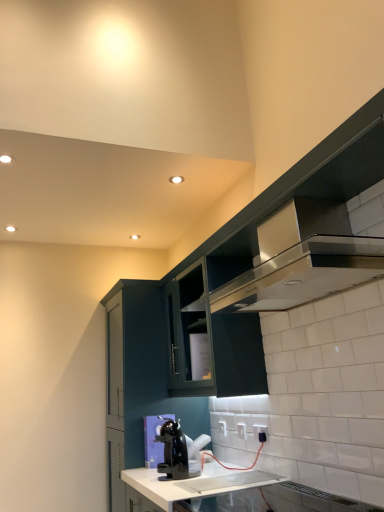
Question: Is matte dark green cabinet at center, positioned as the third cabinetry in right-to-left order, situated inside white glossy countertop at lower center or outside?

Choices:
 (A) inside
 (B) outside

Answer: (B)

Question: Considering the positions of matte dark green cabinet at center, positioned as the third cabinetry in right-to-left order, and white glossy countertop at lower center in the image, is matte dark green cabinet at center, positioned as the third cabinetry in right-to-left order, wider or thinner than white glossy countertop at lower center?

Choices:
 (A) thin
 (B) wide

Answer: (A)

Question: Which is farther from the matte dark green cabinet at center, which is the first cabinetry from left to right?

Choices:
 (A) satin silver exhaust hood at upper right
 (B) satin black cabinet at upper right, arranged as the 1th cabinetry when viewed from the right
 (C) white glossy electric outlet at lower center, marked as the 1th electric outlet in a right-to-left arrangement
 (D) white glossy countertop at lower center
 (E) white plastic electric outlet at lower center, which is the second electric outlet in left-to-right order

Answer: (A)

Question: Estimate the real-world distances between objects in this image. Which object is farther from the white plastic electric outlet at lower center, which appears as the 1th electric outlet when viewed from the left?

Choices:
 (A) white glossy countertop at lower center
 (B) matte dark green cabinet at upper center, the second cabinetry when ordered from left to right
 (C) black plastic coffee maker at lower center
 (D) satin black cabinet at upper right, which is the third cabinetry in left-to-right order
 (E) white plastic electric outlet at lower center, positioned as the 2th electric outlet in front-to-back order

Answer: (D)